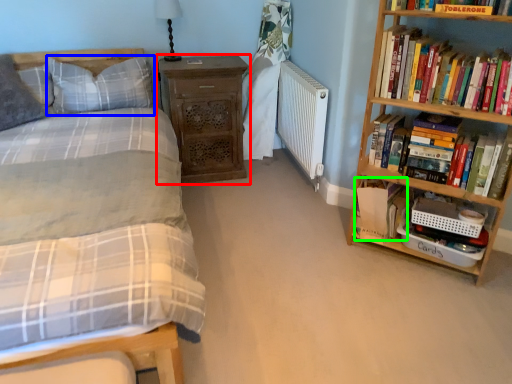
Question: Which is farther away from nightstand (highlighted by a red box)? pillow (highlighted by a blue box) or book (highlighted by a green box)?

Choices:
 (A) pillow
 (B) book

Answer: (B)